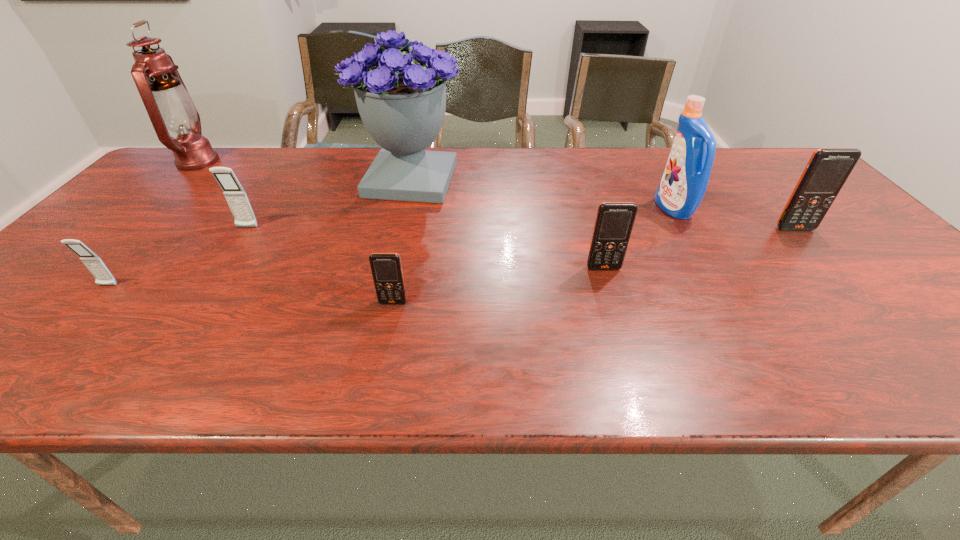
Where is `orange cellular telephone that is the closest one to the third farthest cellular telephone`? This screenshot has height=540, width=960. orange cellular telephone that is the closest one to the third farthest cellular telephone is located at coordinates (386, 268).

This screenshot has width=960, height=540. In order to click on vacant space that satisfies the following two spatial constraints: 1. on the label of the detergent; 2. on the screen of the third nearest object in this screenshot , I will do `click(708, 268)`.